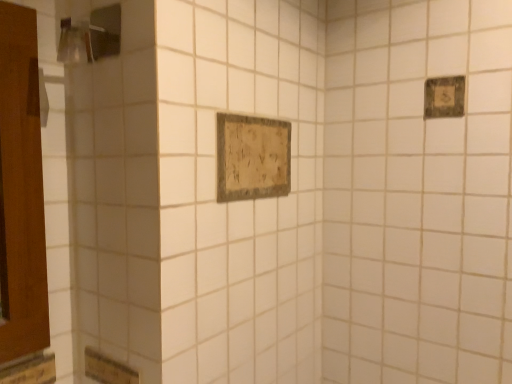
Question: From a real-world perspective, does distressed wood sign at center, acting as the second rectangle starting from the top, sit lower than brushed metal shower at upper left?

Choices:
 (A) no
 (B) yes

Answer: (B)

Question: Does distressed wood sign at center, arranged as the 1th rectangle when viewed from the left, appear on the left side of brushed metal shower at upper left?

Choices:
 (A) no
 (B) yes

Answer: (A)

Question: From a real-world perspective, is distressed wood sign at center, arranged as the 1th rectangle when viewed from the left, physically above brushed metal shower at upper left?

Choices:
 (A) no
 (B) yes

Answer: (A)

Question: Is distressed wood sign at center, arranged as the 1th rectangle when viewed from the left, wider than brushed metal shower at upper left?

Choices:
 (A) yes
 (B) no

Answer: (B)

Question: Is distressed wood sign at center, arranged as the 1th rectangle when viewed from the left, far from brushed metal shower at upper left?

Choices:
 (A) no
 (B) yes

Answer: (A)

Question: Does distressed wood sign at center, which is the 1th rectangle in bottom-to-top order, have a lesser height compared to brushed metal shower at upper left?

Choices:
 (A) yes
 (B) no

Answer: (B)

Question: Is wooden plaque at upper right, which is the 2th rectangle from bottom to top, looking in the opposite direction of brushed metal shower at upper left?

Choices:
 (A) yes
 (B) no

Answer: (B)

Question: Does wooden plaque at upper right, acting as the first rectangle starting from the top, have a greater width compared to brushed metal shower at upper left?

Choices:
 (A) yes
 (B) no

Answer: (B)

Question: Is wooden plaque at upper right, which is the 1th rectangle in right-to-left order, closer to the viewer compared to brushed metal shower at upper left?

Choices:
 (A) yes
 (B) no

Answer: (B)

Question: Is wooden plaque at upper right, acting as the first rectangle starting from the top, thinner than brushed metal shower at upper left?

Choices:
 (A) yes
 (B) no

Answer: (A)

Question: Can you confirm if wooden plaque at upper right, which is the 2th rectangle from bottom to top, is bigger than brushed metal shower at upper left?

Choices:
 (A) yes
 (B) no

Answer: (B)

Question: Is wooden plaque at upper right, which is the 1th rectangle in right-to-left order, taller than brushed metal shower at upper left?

Choices:
 (A) yes
 (B) no

Answer: (B)

Question: Is wooden plaque at upper right, acting as the first rectangle starting from the top, not close to distressed wood sign at center, which is counted as the second rectangle, starting from the right?

Choices:
 (A) no
 (B) yes

Answer: (A)